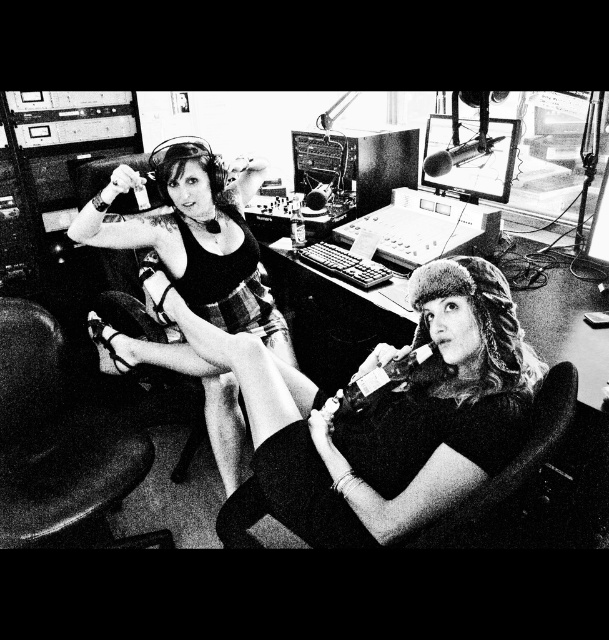
Measure the distance between matte black dress at left and camera.

matte black dress at left and camera are 1.58 meters apart from each other.

Where is `matte black dress at left`? matte black dress at left is located at coordinates (195, 237).

Is point (582, 404) more distant than point (454, 161)?

No, it is not.

Does metallic keyboard at center have a lesser width compared to metallic silver microphone at upper center?

In fact, metallic keyboard at center might be wider than metallic silver microphone at upper center.

This screenshot has width=609, height=640. Identify the location of metallic keyboard at center. (329, 314).

Where is `metallic keyboard at center`? metallic keyboard at center is located at coordinates (329, 314).

Does matte black dress at left appear on the left side of metallic silver microphone at upper center?

Indeed, matte black dress at left is positioned on the left side of metallic silver microphone at upper center.

Which of these two, matte black dress at left or metallic silver microphone at upper center, stands shorter?

metallic silver microphone at upper center is shorter.

Measure the distance between matte black dress at left and camera.

1.58 meters

Where is `matte black dress at left`? The height and width of the screenshot is (640, 609). matte black dress at left is located at coordinates tap(195, 237).